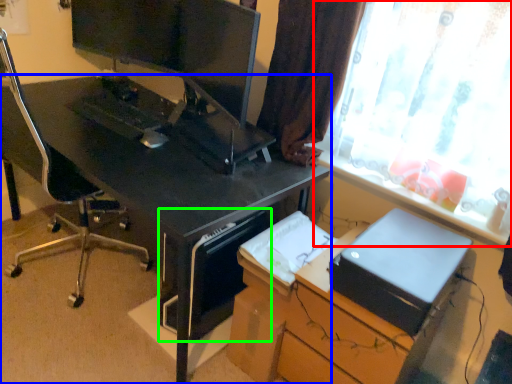
Question: Based on their relative distances, which object is farther from window (highlighted by a red box)? Choose from desk (highlighted by a blue box) and computer tower (highlighted by a green box).

Choices:
 (A) desk
 (B) computer tower

Answer: (B)